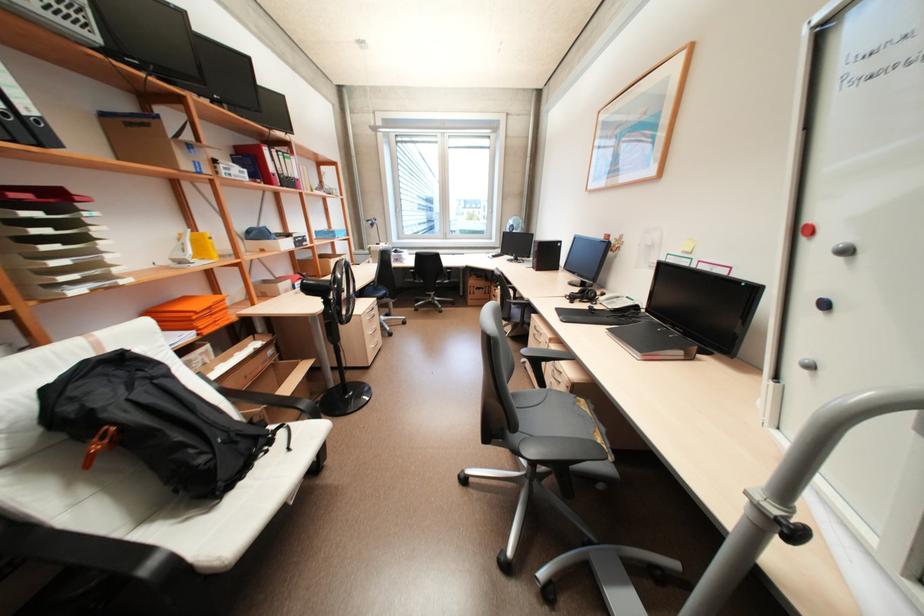
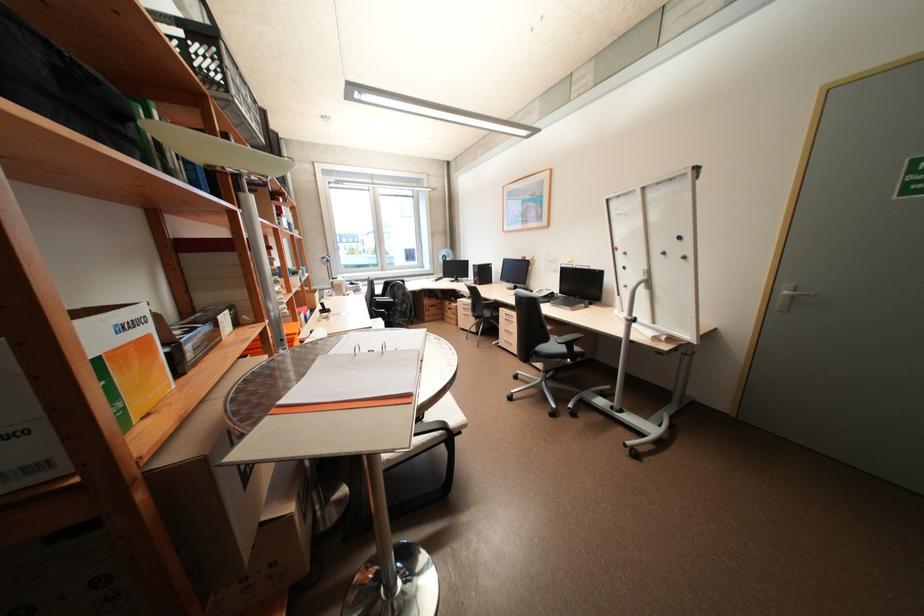
Consider the image. What movement of the cameraman would produce the second image?

The cameraman walked toward left, backward.